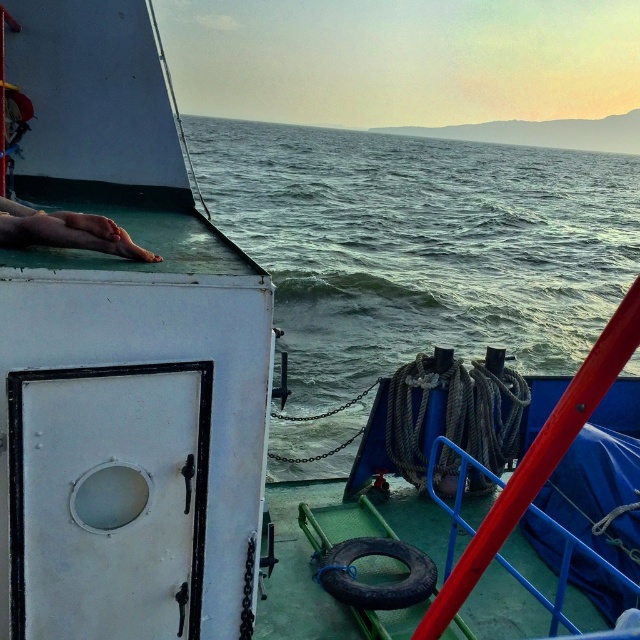
Does greenish-blue water at center have a greater width compared to skinny flesh at lower left?

Yes, greenish-blue water at center is wider than skinny flesh at lower left.

Does greenish-blue water at center appear on the left side of skinny flesh at lower left?

In fact, greenish-blue water at center is to the right of skinny flesh at lower left.

The image size is (640, 640). In order to click on greenish-blue water at center in this screenshot , I will do `click(420, 244)`.